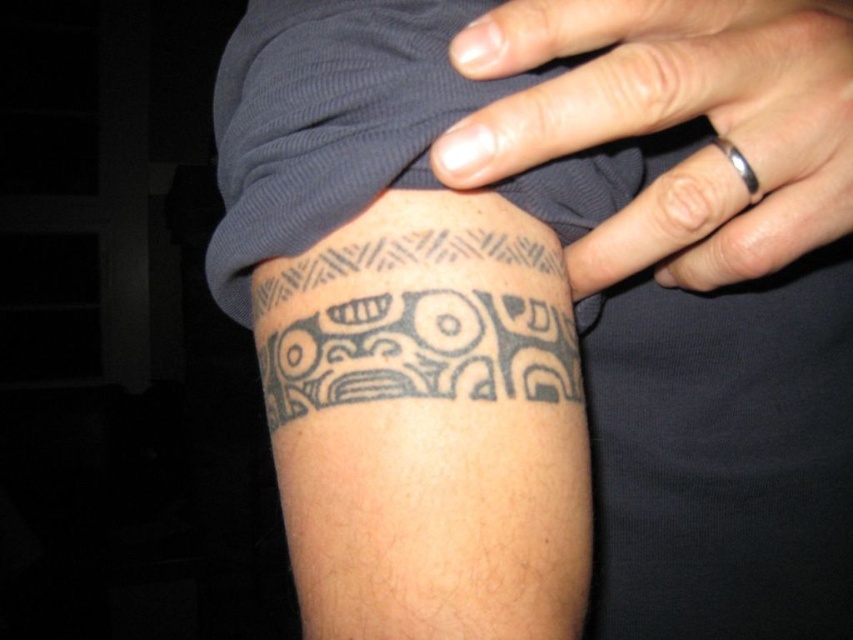
Consider the image. You are a tattoo artist assessing a client who wants to add a new ring to their existing tattoo. The client has a black matte ring at upper center and a black ink tattoo at lower center. Can you determine if the ring will cover part of the tattoo based on their positions?

The black matte ring at upper center is positioned over the black ink tattoo at lower center, so yes, the ring will cover part of the tattoo since it is placed directly above it.

You are standing 10 feet away from the person. Can you see the point at point [437,164] clearly?

The point at point [437,164] is 10.11 inches from the viewer, so yes, you can see it clearly from 10 feet away.

You are a tattoo artist assessing a client who wants to add a new ring to their existing tattoo. The client has a black matte ring at upper center and a black ink tattoo at lower center. Which object is located to the right of the other?

The black matte ring at upper center is positioned on the right side of black ink tattoo at lower center.